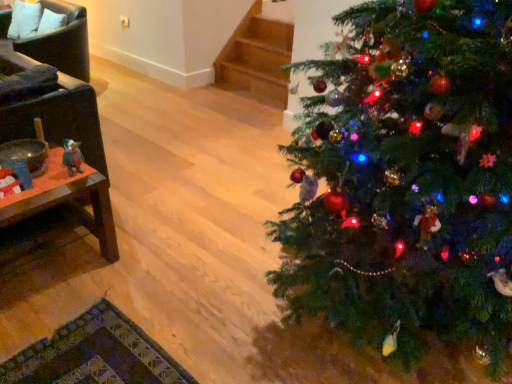
Where is `free space between green matte christmas tree at right and dark brown leather armchair at left, which appears as the 2th armchair when viewed from the top`? The width and height of the screenshot is (512, 384). free space between green matte christmas tree at right and dark brown leather armchair at left, which appears as the 2th armchair when viewed from the top is located at coordinates (192, 213).